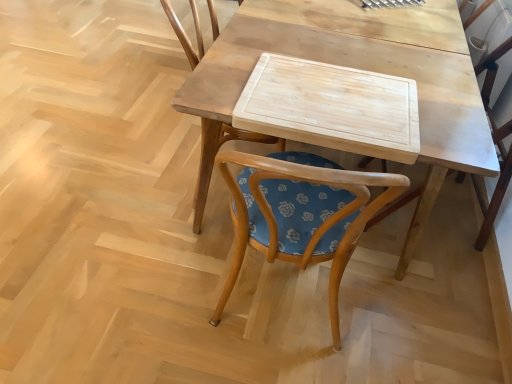
Identify the location of free space in front of wooden chair at center, arranged as the 1th chair when viewed from the right. (422, 281).